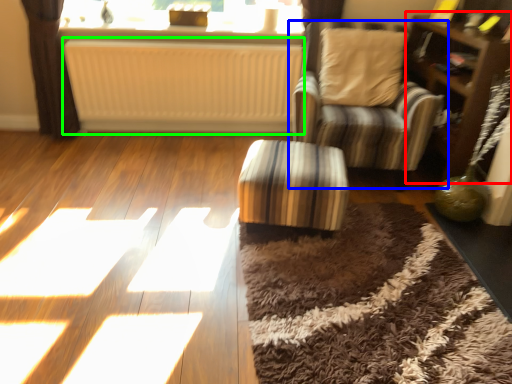
Question: Based on their relative distances, which object is nearer to dresser (highlighted by a red box)? Choose from chair (highlighted by a blue box) and radiator (highlighted by a green box).

Choices:
 (A) chair
 (B) radiator

Answer: (A)